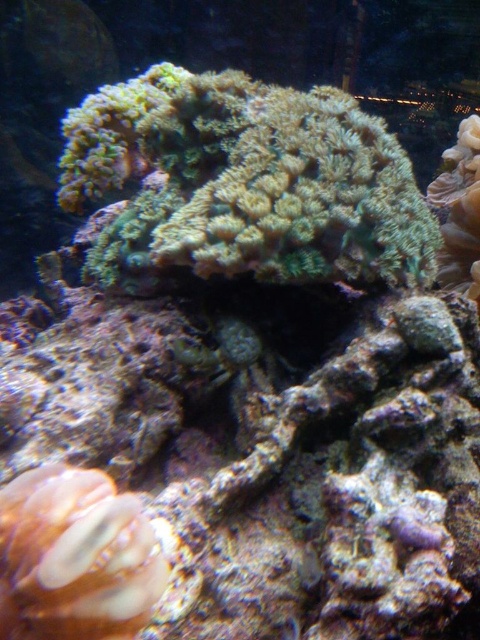
Question: Does green textured coral at center appear over translucent orange coral at lower left?

Choices:
 (A) no
 (B) yes

Answer: (B)

Question: Is green textured coral at center to the right of translucent orange coral at lower left from the viewer's perspective?

Choices:
 (A) no
 (B) yes

Answer: (B)

Question: Does green textured coral at center have a lesser width compared to translucent orange coral at lower left?

Choices:
 (A) no
 (B) yes

Answer: (A)

Question: Which point is farther to the camera?

Choices:
 (A) (156, 540)
 (B) (389, 157)

Answer: (B)

Question: Which object is farther from the camera taking this photo?

Choices:
 (A) translucent orange coral at lower left
 (B) green textured coral at center

Answer: (B)

Question: Which point is farther to the camera?

Choices:
 (A) translucent orange coral at lower left
 (B) green textured coral at center

Answer: (B)